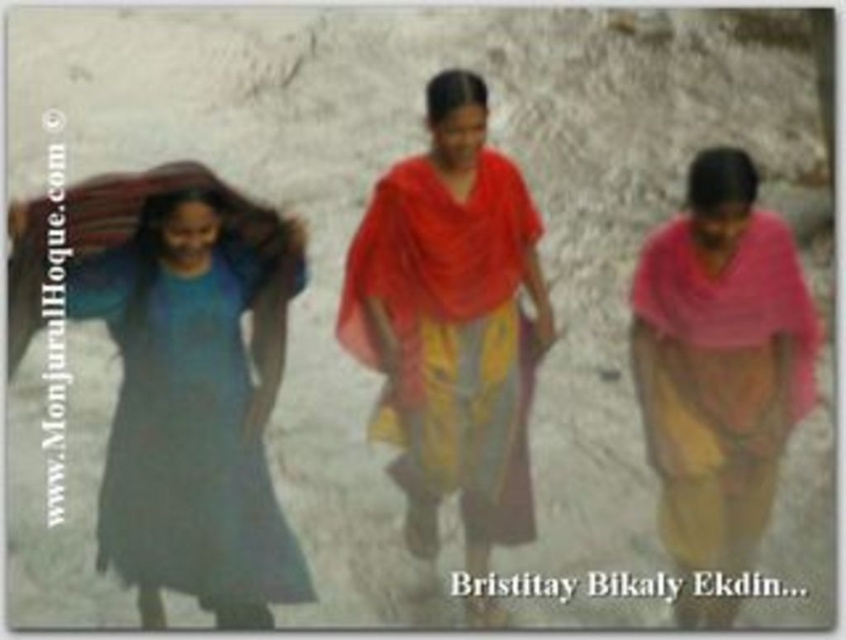
Is point (217, 316) more distant than point (424, 186)?

That is False.

Can you confirm if matte blue dress at left is smaller than red fabric shawl at center?

No.

Is point (196, 352) behind point (400, 208)?

That is False.

The width and height of the screenshot is (846, 640). Find the location of `matte blue dress at left`. matte blue dress at left is located at coordinates (185, 433).

Which of these two, matte red shawl at center or matte blue dress at left, stands shorter?

matte blue dress at left is shorter.

Which is in front, point (476, 260) or point (243, 250)?

Point (243, 250) is in front.

Is point (394, 397) behind point (146, 294)?

Yes, point (394, 397) is behind point (146, 294).

You are a GUI agent. You are given a task and a screenshot of the screen. Output one action in this format:
    pyautogui.click(x=<x>, y=<y>)
    Task: Click on the matte red shawl at center
    
    Given the screenshot: What is the action you would take?
    pyautogui.click(x=451, y=324)

Where is `matte red shawl at center`? This screenshot has height=640, width=846. matte red shawl at center is located at coordinates (451, 324).

Find the location of `matte red shawl at center`. matte red shawl at center is located at coordinates (451, 324).